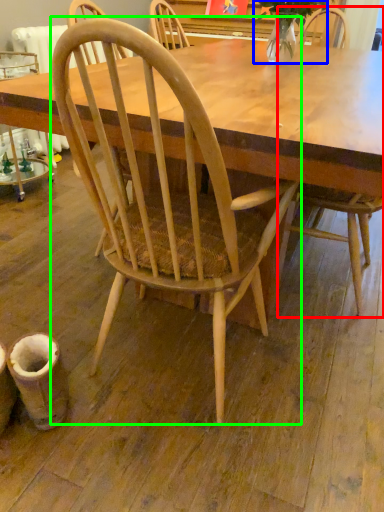
Question: Estimate the real-world distances between objects in this image. Which object is closer to chair (highlighted by a red box), plant (highlighted by a blue box) or chair (highlighted by a green box)?

Choices:
 (A) plant
 (B) chair

Answer: (B)